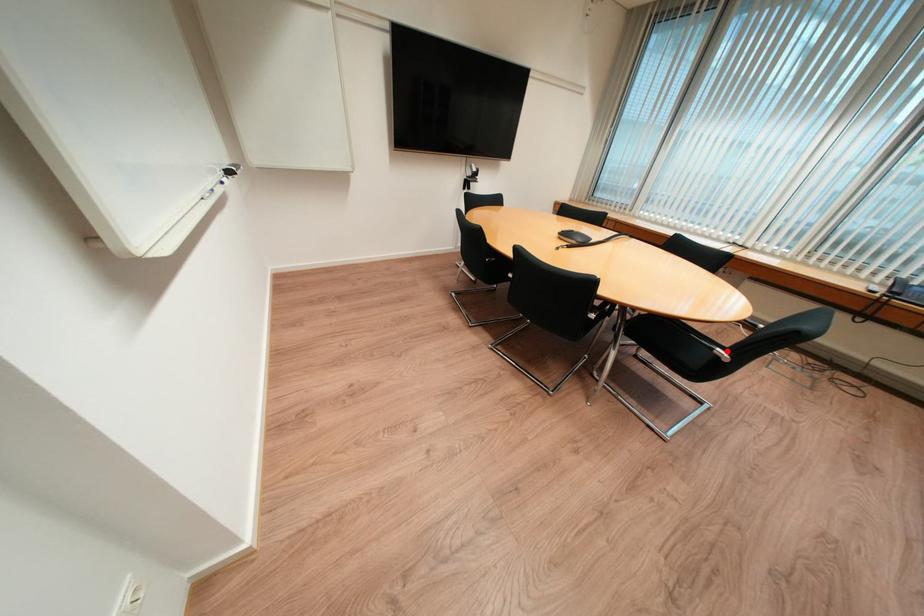
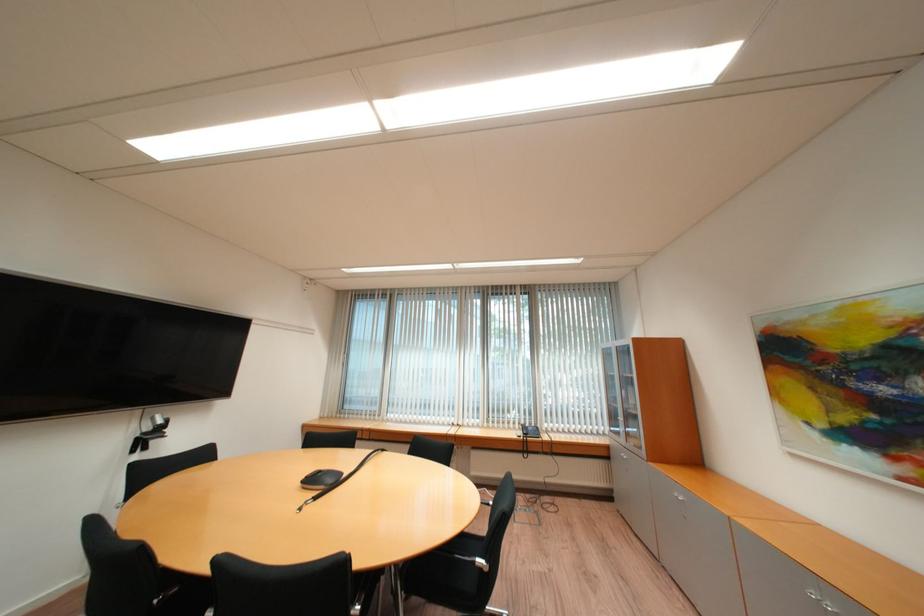
Locate, in the second image, the point that corresponds to the highlighted location in the first image.

(487, 561)